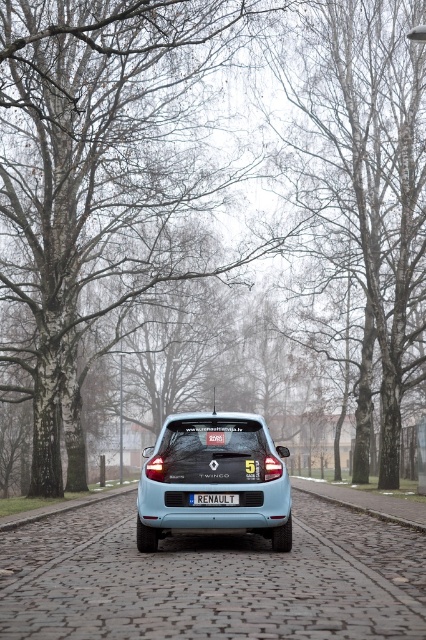
Is cobblestone pavement at center to the left of blue plastic license plate at center from the viewer's perspective?

In fact, cobblestone pavement at center is to the right of blue plastic license plate at center.

Who is positioned more to the right, cobblestone pavement at center or blue plastic license plate at center?

Positioned to the right is cobblestone pavement at center.

Is point (298, 476) farther from camera compared to point (219, 499)?

Yes, it is.

Locate an element on the screen. The width and height of the screenshot is (426, 640). cobblestone pavement at center is located at coordinates (365, 502).

Does light blue matte hatchback at center have a larger size compared to blue plastic license plate at center?

Indeed, light blue matte hatchback at center has a larger size compared to blue plastic license plate at center.

Who is more distant from viewer, (224, 454) or (198, 492)?

The point (224, 454) is behind.

Where is `light blue matte hatchback at center`? This screenshot has height=640, width=426. light blue matte hatchback at center is located at coordinates (213, 480).

Does cobblestone at lower center appear on the left side of blue plastic license plate at center?

Indeed, cobblestone at lower center is positioned on the left side of blue plastic license plate at center.

Which is behind, point (16, 522) or point (204, 496)?

Point (16, 522)

Find the location of a particular element. cobblestone at lower center is located at coordinates (62, 508).